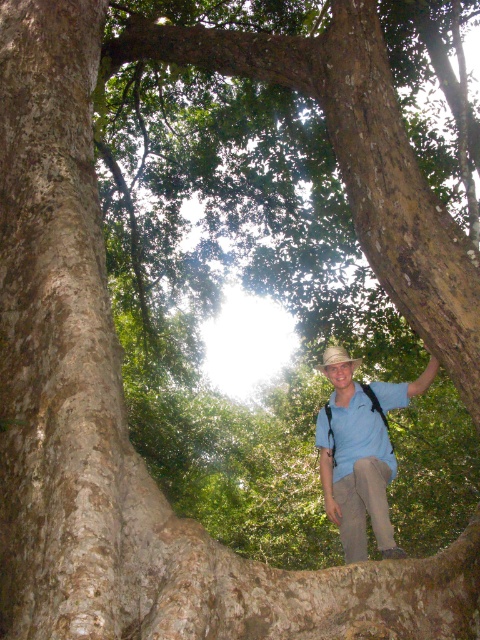
Does blue cotton shirt at center have a lesser width compared to light blue cotton shirt at center?

No, blue cotton shirt at center is not thinner than light blue cotton shirt at center.

Can you confirm if blue cotton shirt at center is positioned above light blue cotton shirt at center?

No, blue cotton shirt at center is not above light blue cotton shirt at center.

Between point (333, 506) and point (351, 404), which one is positioned in front?

Point (333, 506) is more forward.

Where is `blue cotton shirt at center`? This screenshot has width=480, height=640. blue cotton shirt at center is located at coordinates (360, 454).